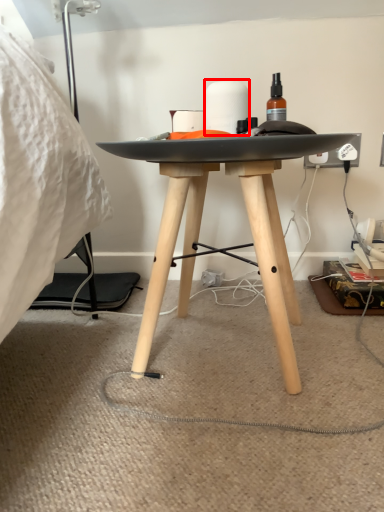
Question: From the image's perspective, where is toilet paper (annotated by the red box) located in relation to string in the image?

Choices:
 (A) below
 (B) above

Answer: (B)